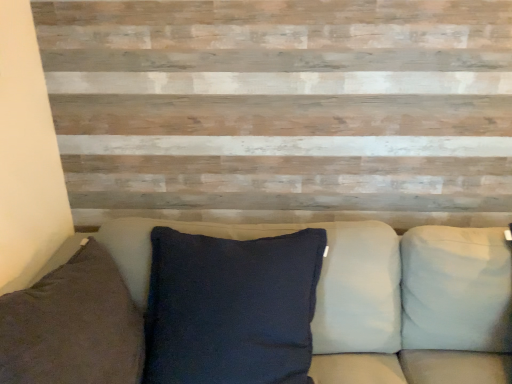
Question: Does white fabric pillow at right, marked as the second pillow in a left-to-right arrangement, have a larger size compared to dark blue fabric pillow at left, the first pillow from the left?

Choices:
 (A) no
 (B) yes

Answer: (A)

Question: Is white fabric pillow at right, marked as the second pillow in a left-to-right arrangement, far away from dark blue fabric pillow at left, which ranks as the 2th pillow in right-to-left order?

Choices:
 (A) no
 (B) yes

Answer: (B)

Question: From the image's perspective, does white fabric pillow at right, marked as the second pillow in a left-to-right arrangement, appear lower than dark blue fabric pillow at left, which ranks as the 2th pillow in right-to-left order?

Choices:
 (A) yes
 (B) no

Answer: (B)

Question: Is white fabric pillow at right, the 1th pillow positioned from the right, at the left side of dark blue fabric pillow at left, which ranks as the 2th pillow in right-to-left order?

Choices:
 (A) no
 (B) yes

Answer: (A)

Question: Does white fabric pillow at right, the 1th pillow positioned from the right, appear on the right side of dark blue fabric pillow at left, the first pillow from the left?

Choices:
 (A) yes
 (B) no

Answer: (A)

Question: From the image's perspective, is white fabric pillow at right, the 1th pillow positioned from the right, over dark blue fabric pillow at left, the first pillow from the left?

Choices:
 (A) yes
 (B) no

Answer: (A)

Question: Is dark blue fabric pillow at left, which ranks as the 2th pillow in right-to-left order, at the right side of dark fabric cushion at center?

Choices:
 (A) yes
 (B) no

Answer: (B)

Question: Can you confirm if dark blue fabric pillow at left, which ranks as the 2th pillow in right-to-left order, is smaller than dark fabric cushion at center?

Choices:
 (A) yes
 (B) no

Answer: (A)

Question: Is dark blue fabric pillow at left, which ranks as the 2th pillow in right-to-left order, taller than dark fabric cushion at center?

Choices:
 (A) yes
 (B) no

Answer: (B)

Question: Does dark blue fabric pillow at left, the first pillow from the left, have a lesser width compared to dark fabric cushion at center?

Choices:
 (A) no
 (B) yes

Answer: (B)

Question: Does dark blue fabric pillow at left, the first pillow from the left, have a lesser height compared to dark fabric cushion at center?

Choices:
 (A) yes
 (B) no

Answer: (A)

Question: Can you confirm if dark blue fabric pillow at left, the first pillow from the left, is bigger than dark fabric cushion at center?

Choices:
 (A) yes
 (B) no

Answer: (B)

Question: Is dark blue fabric pillow at left, which ranks as the 2th pillow in right-to-left order, at the right side of white fabric pillow at right, marked as the second pillow in a left-to-right arrangement?

Choices:
 (A) yes
 (B) no

Answer: (B)